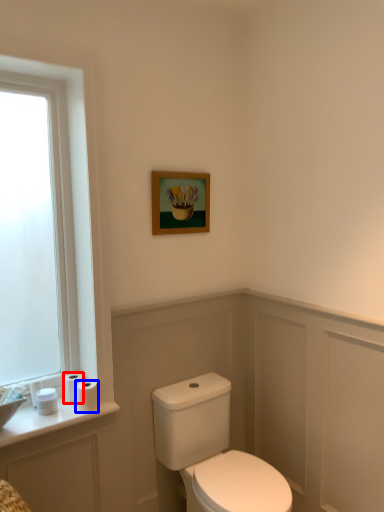
Question: Which point is further to the camera, toilet paper (highlighted by a red box) or toilet paper (highlighted by a blue box)?

Choices:
 (A) toilet paper
 (B) toilet paper

Answer: (A)